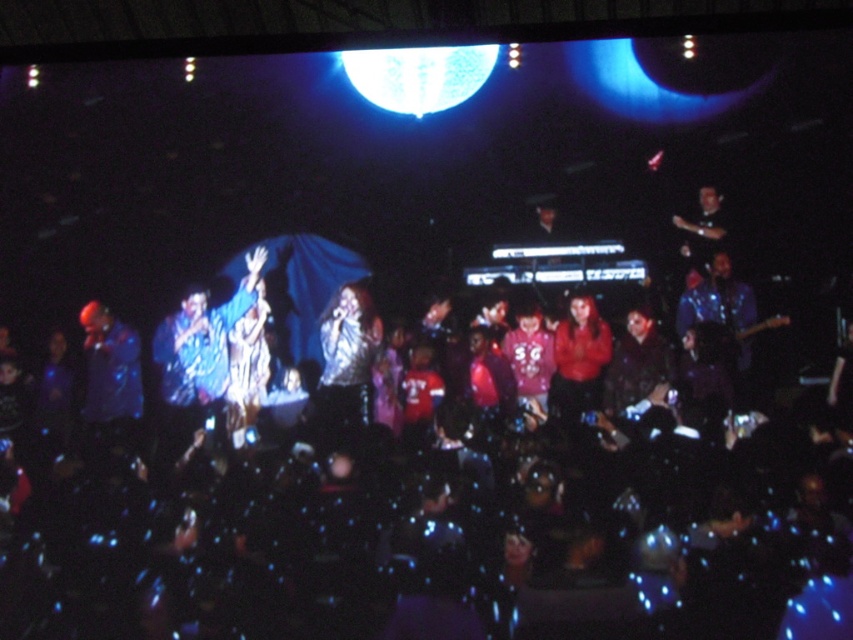
Question: Estimate the real-world distances between objects in this image. Which object is farther from the blue shiny jacket at left?

Choices:
 (A) shiny silver jacket at center
 (B) shiny blue jacket at center
 (C) matte red shirt at center

Answer: (C)

Question: Among these points, which one is nearest to the camera?

Choices:
 (A) (198, 396)
 (B) (352, 321)

Answer: (A)

Question: Does blue shiny jacket at left have a smaller size compared to matte red shirt at center?

Choices:
 (A) yes
 (B) no

Answer: (A)

Question: Is shiny blue jacket at center thinner than matte red shirt at center?

Choices:
 (A) yes
 (B) no

Answer: (B)

Question: In this image, where is shiny silver jacket at center located relative to matte red shirt at center?

Choices:
 (A) right
 (B) left

Answer: (B)

Question: Which object is positioned farthest from the shiny blue jacket at center?

Choices:
 (A) matte red shirt at center
 (B) blue shiny jacket at left
 (C) shiny silver jacket at center

Answer: (A)